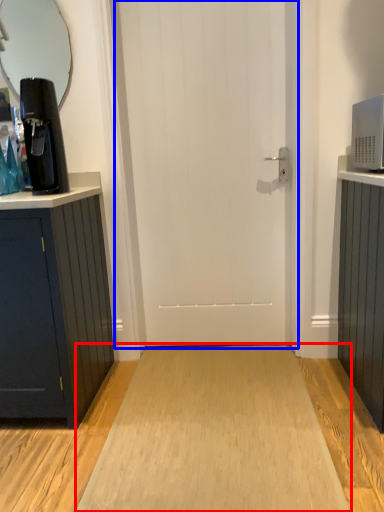
Question: Which object is further to the camera taking this photo, plain (highlighted by a red box) or door (highlighted by a blue box)?

Choices:
 (A) plain
 (B) door

Answer: (B)